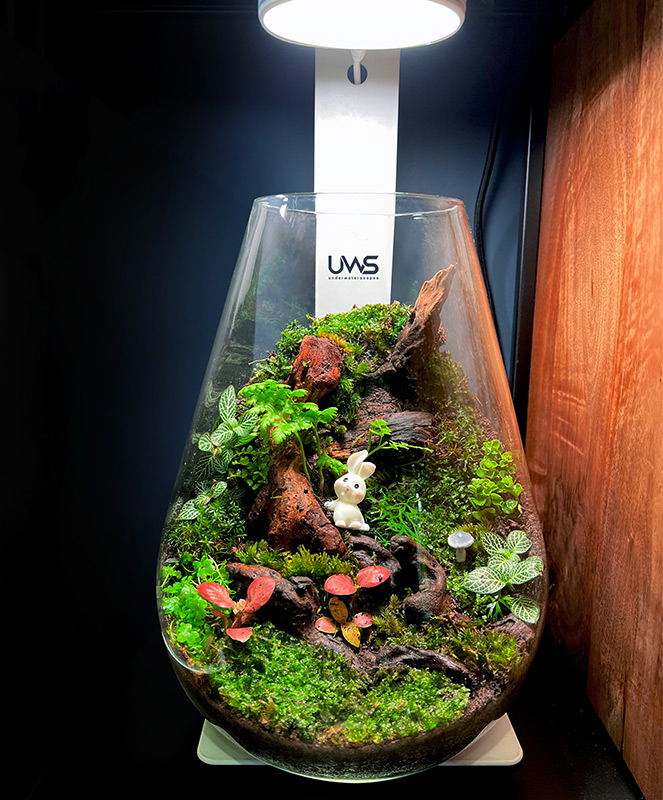
Identify the location of wall. (211, 121).